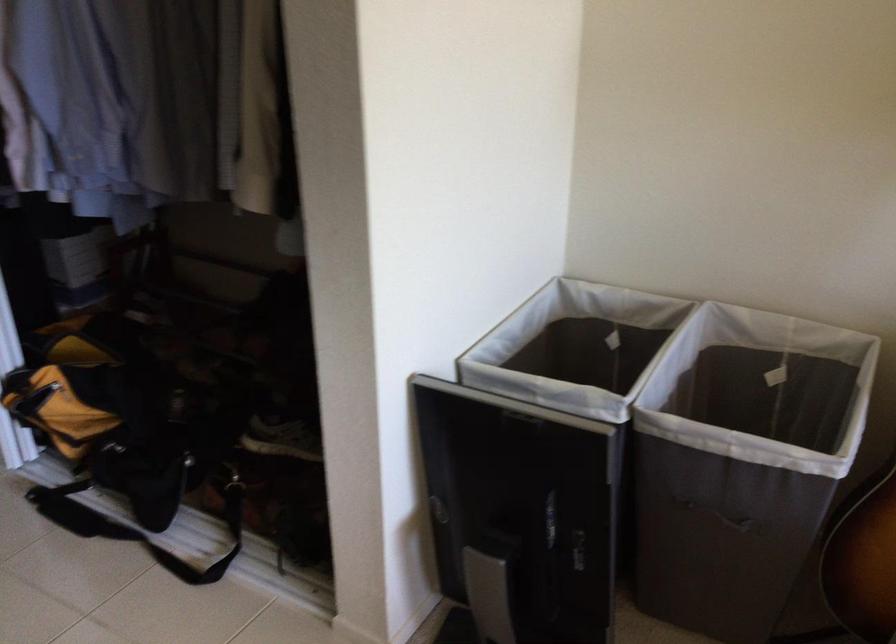
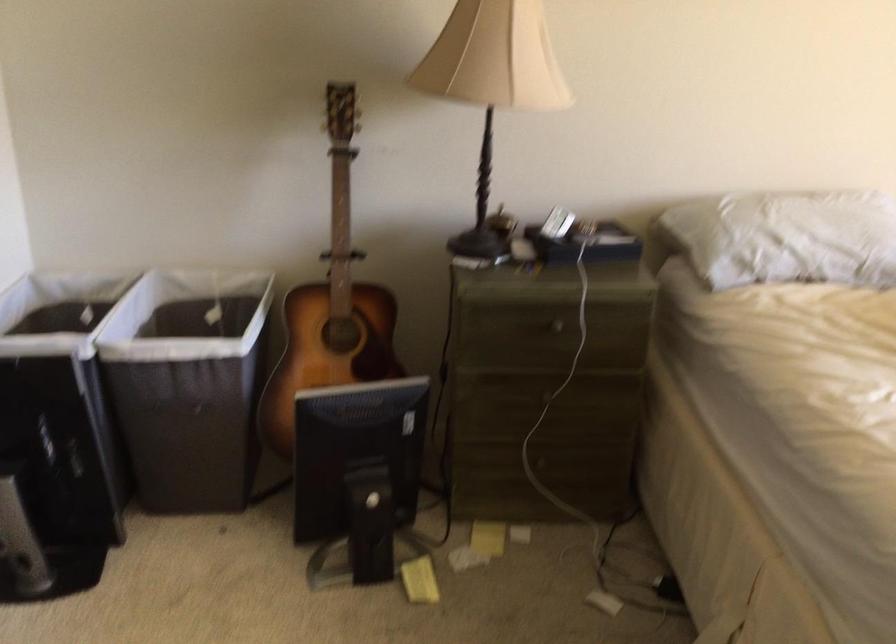
Locate, in the second image, the point that corresponds to (733,485) in the first image.

(188, 384)